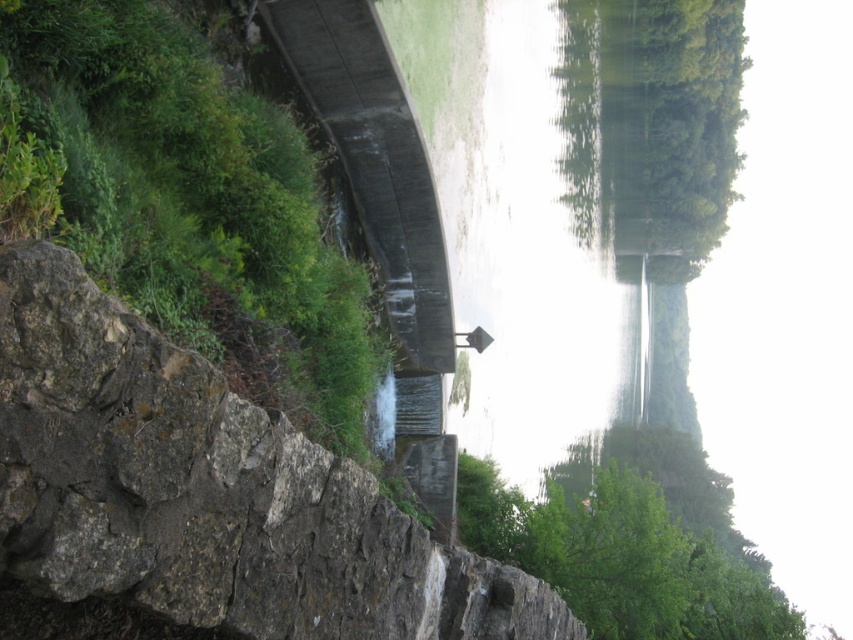
Which is behind, point (412, 556) or point (659, 493)?

Point (659, 493)

Does brown rough stone at center have a smaller size compared to green leafy tree at lower right?

Yes.

Is point (154, 420) behind point (462, 476)?

That is False.

The image size is (853, 640). Identify the location of brown rough stone at center. (207, 492).

Is green leafy vegetation at lower left bigger than green leafy tree at lower right?

Incorrect, green leafy vegetation at lower left is not larger than green leafy tree at lower right.

Between green leafy vegetation at lower left and green leafy tree at lower right, which one is positioned higher?

green leafy vegetation at lower left is higher up.

Which is behind, point (28, 48) or point (749, 605)?

The point (749, 605) is behind.

Find the location of a particular element. green leafy vegetation at lower left is located at coordinates (189, 204).

Is brown rough stone at center further to camera compared to green leafy vegetation at lower left?

No, it is in front of green leafy vegetation at lower left.

Which is behind, point (109, 522) or point (277, 394)?

The point (277, 394) is more distant.

Does point (160, 483) come behind point (178, 99)?

No.

Where is `brown rough stone at center`? The height and width of the screenshot is (640, 853). brown rough stone at center is located at coordinates (207, 492).